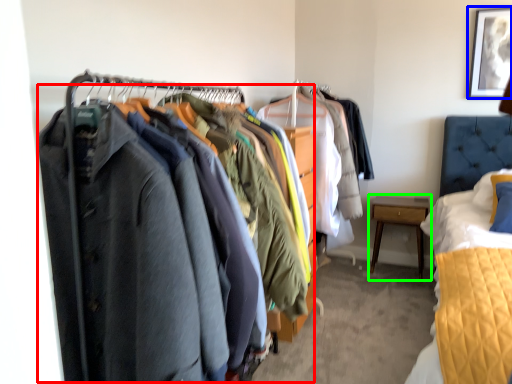
Question: Based on their relative distances, which object is farther from closet (highlighted by a red box)? Choose from picture frame (highlighted by a blue box) and nightstand (highlighted by a green box).

Choices:
 (A) picture frame
 (B) nightstand

Answer: (A)